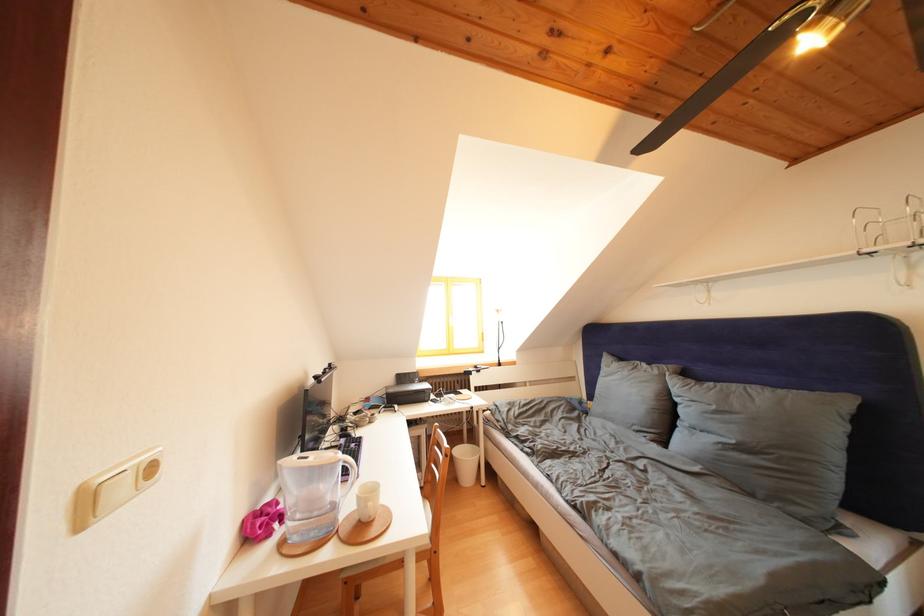
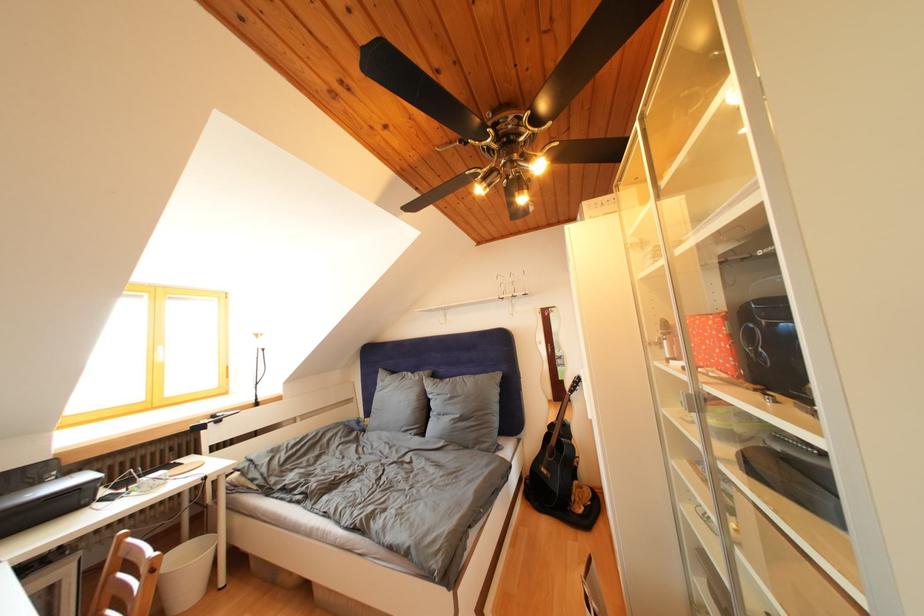
Where in the second image is the point corresponding to (475,463) from the first image?

(198, 565)